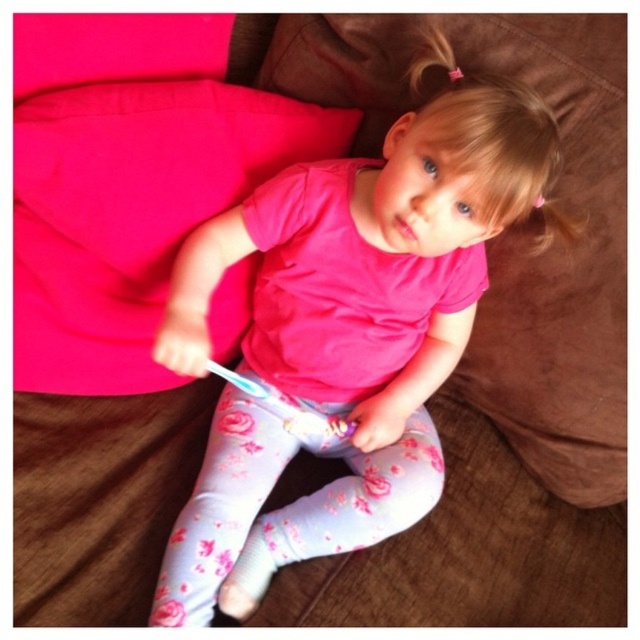
Question: Considering the real-world distances, which object is farthest from the pink fabric pillow at upper left?

Choices:
 (A) white plastic toothbrush at lower center
 (B) pink matte shirt at center

Answer: (A)

Question: Can you confirm if pink matte shirt at center is wider than white plastic toothbrush at lower center?

Choices:
 (A) no
 (B) yes

Answer: (B)

Question: Which of the following is the farthest from the observer?

Choices:
 (A) pink matte shirt at center
 (B) white plastic toothbrush at lower center

Answer: (B)

Question: Which point appears farthest from the camera in this image?

Choices:
 (A) pos(253,381)
 (B) pos(22,106)
 (C) pos(214,604)

Answer: (A)

Question: Can you confirm if pink matte shirt at center is wider than white plastic toothbrush at lower center?

Choices:
 (A) no
 (B) yes

Answer: (B)

Question: Is pink matte shirt at center below pink fabric pillow at upper left?

Choices:
 (A) no
 (B) yes

Answer: (B)